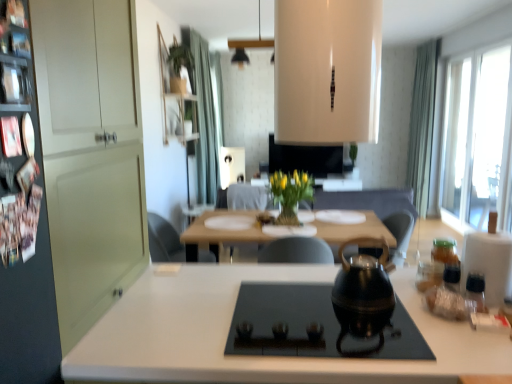
Find the location of a particular element. This screenshot has width=512, height=384. free space in front of black matte tea pot at center is located at coordinates (375, 332).